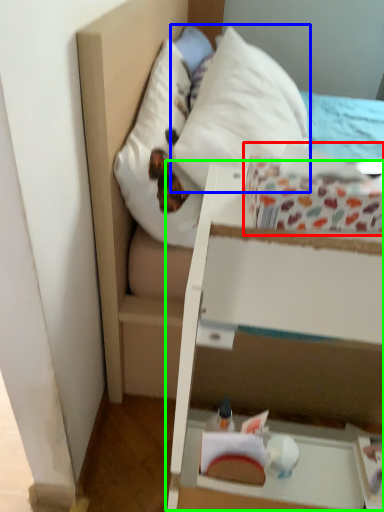
Question: Considering the real-world distances, which object is farthest from cardboard box (highlighted by a red box)? pillow (highlighted by a blue box) or vanity (highlighted by a green box)?

Choices:
 (A) pillow
 (B) vanity

Answer: (A)